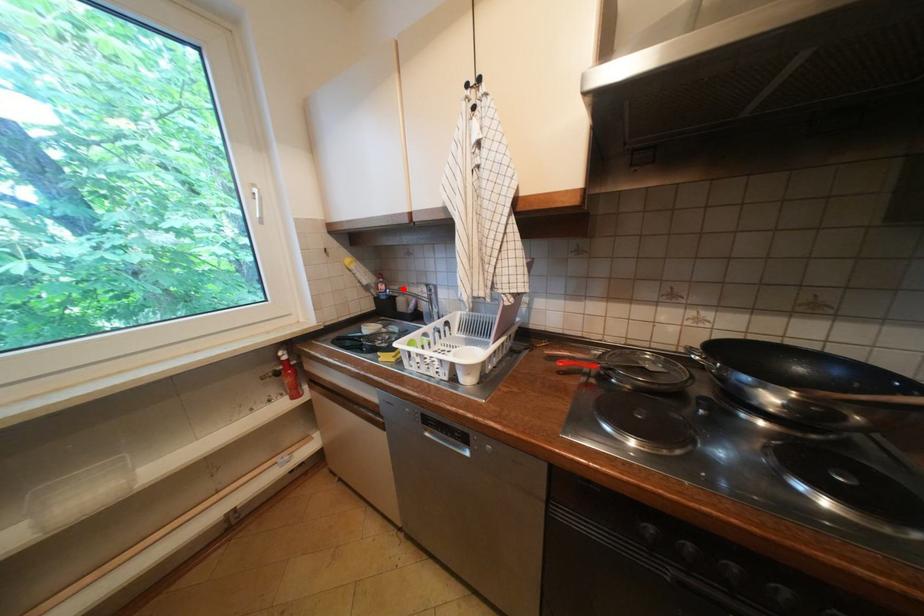
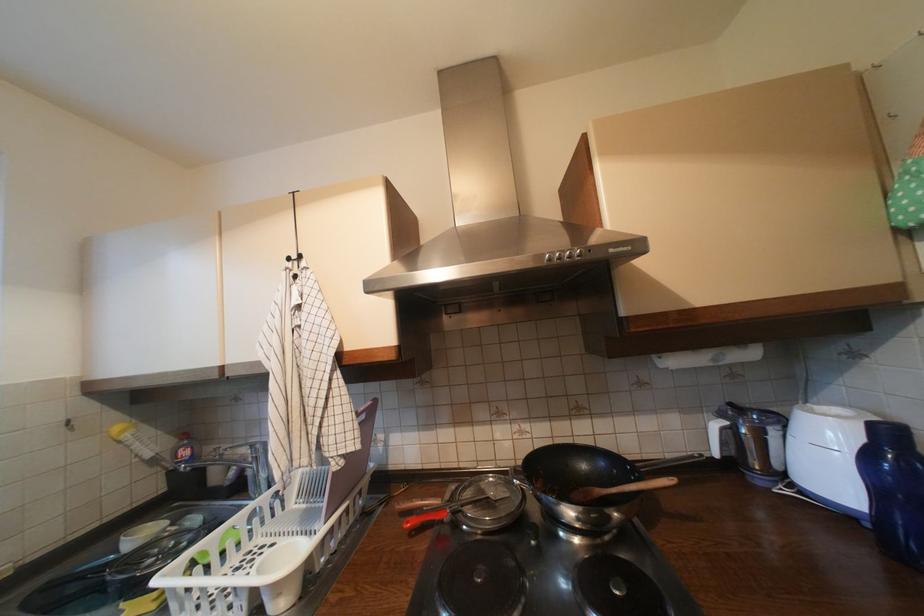
In the second image, find the point that corresponds to the highlighted location in the first image.

(217, 450)